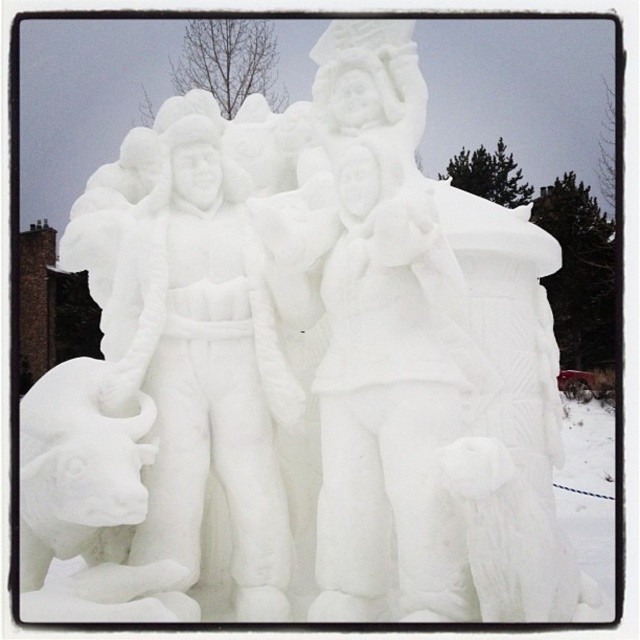
Between point (392, 452) and point (42, 474), which one is positioned in front?

Point (42, 474) is more forward.

Where is `white snow sculpture at center`? white snow sculpture at center is located at coordinates (384, 381).